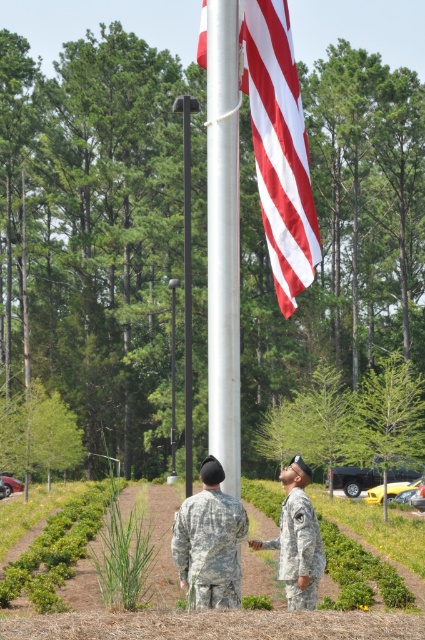
Does red/white striped flag at upper center appear on the left side of camouflage fabric uniform at center?

Correct, you'll find red/white striped flag at upper center to the left of camouflage fabric uniform at center.

Does point (274, 61) come in front of point (286, 504)?

That is True.

This screenshot has width=425, height=640. What do you see at coordinates (278, 147) in the screenshot? I see `red/white striped flag at upper center` at bounding box center [278, 147].

Identify the location of red/white striped flag at upper center. (278, 147).

The width and height of the screenshot is (425, 640). Identify the location of silver metallic flag pole at center. 223,237.

What do you see at coordinates (223, 237) in the screenshot?
I see `silver metallic flag pole at center` at bounding box center [223, 237].

The width and height of the screenshot is (425, 640). In order to click on silver metallic flag pole at center in this screenshot , I will do `click(223, 237)`.

Consider the image. Between red/white striped flag at upper center and silver metallic flag pole at center, which one is positioned lower?

red/white striped flag at upper center is lower down.

Between red/white striped flag at upper center and silver metallic flag pole at center, which one is positioned higher?

silver metallic flag pole at center is above.

You are a GUI agent. You are given a task and a screenshot of the screen. Output one action in this format:
    pyautogui.click(x=<x>, y=<y>)
    Task: Click on the red/white striped flag at upper center
    This screenshot has width=425, height=640.
    Given the screenshot: What is the action you would take?
    pyautogui.click(x=278, y=147)